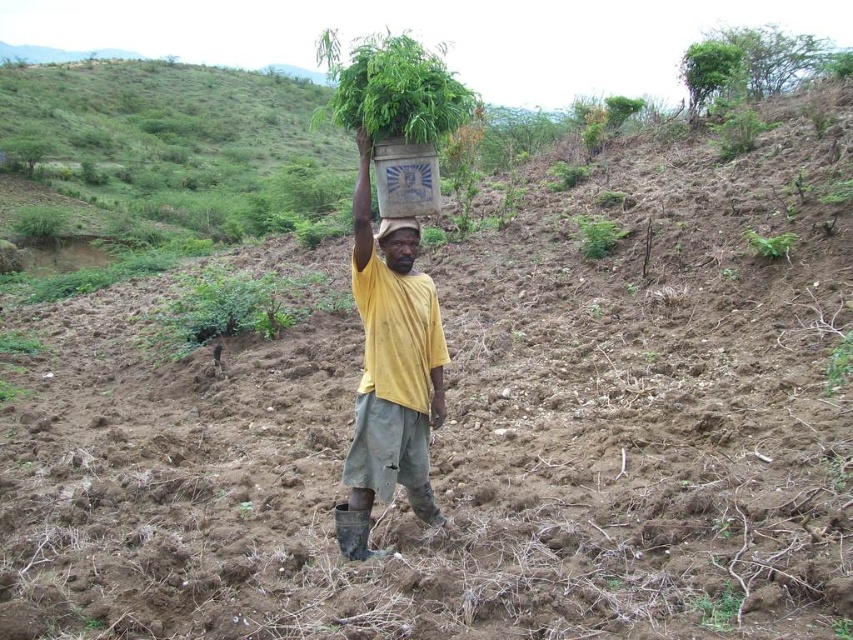
In the scene shown: You are a photographer trying to capture the person in the yellow matte shirt at center and the green leafy plant at lower right. Which object is closer to the camera?

The yellow matte shirt at center is closer to the camera than the green leafy plant at lower right because it is further to the viewer.

You are standing at the origin point in the image. The yellow matte shirt at center is represented by point (390, 371). Which direction should you move to reach the yellow matte shirt at center?

Since the yellow matte shirt at center is located at point (390, 371), you should move towards that coordinate to reach it.